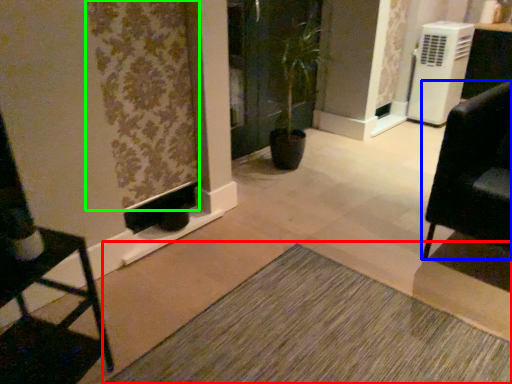
Question: Which object is positioned closest to doormat (highlighted by a red box)? Select from furniture (highlighted by a blue box) and curtain (highlighted by a green box).

Choices:
 (A) furniture
 (B) curtain

Answer: (A)